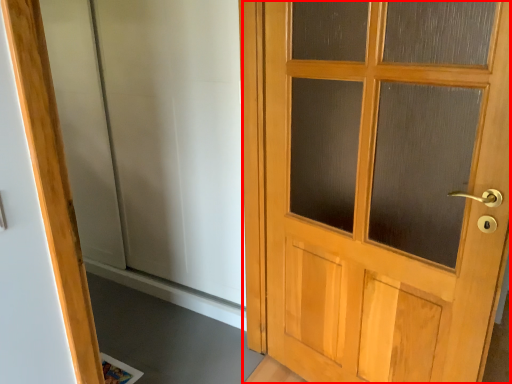
Question: From the image, what is the correct spatial relationship of door (annotated by the red box) in relation to elevator?

Choices:
 (A) left
 (B) right

Answer: (B)